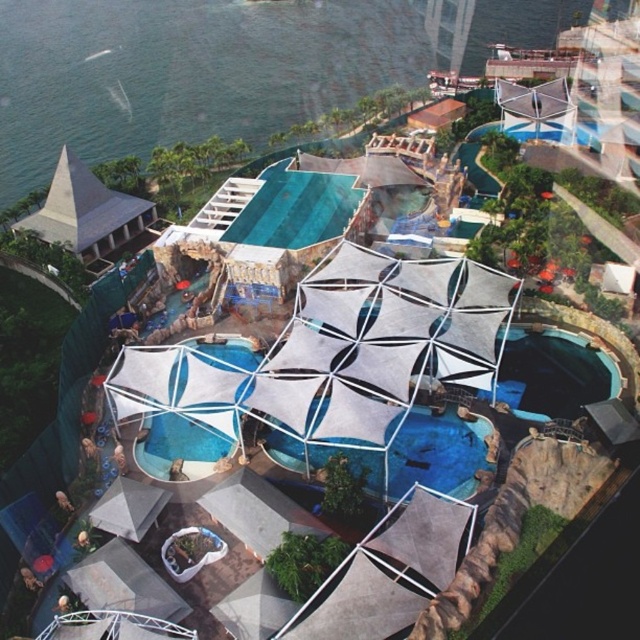
Between point (388, 422) and point (156, 218), which one is positioned behind?

The point (156, 218) is behind.

Does point (115, 378) lie in front of point (140, 209)?

That is True.

The height and width of the screenshot is (640, 640). Identify the location of white fabric pool at center. (285, 412).

Is transparent plastic pool at center bigger than matte gray pyramid at upper left?

No.

Does point (432, 428) come farther from viewer compared to point (84, 211)?

That is False.

The image size is (640, 640). In order to click on transparent plastic pool at center in this screenshot , I will do `click(419, 454)`.

Is white fabric pool at center thinner than transparent plastic pool at center?

Incorrect, white fabric pool at center's width is not less than transparent plastic pool at center's.

Find the location of a particular element. This screenshot has width=640, height=640. white fabric pool at center is located at coordinates (285, 412).